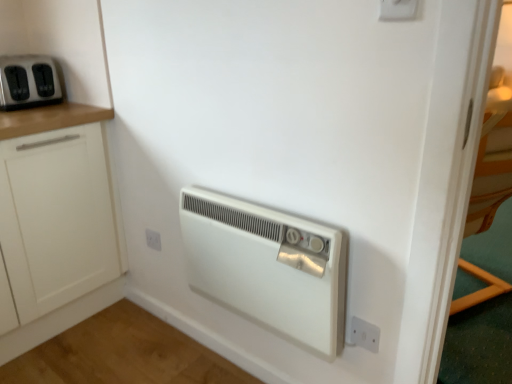
Question: Is white plastic heater at center, placed as the second home appliance when sorted from left to right, smaller than white matte cabinet at left?

Choices:
 (A) yes
 (B) no

Answer: (A)

Question: From a real-world perspective, is white plastic heater at center, which appears as the first home appliance when viewed from the front, under white matte cabinet at left?

Choices:
 (A) no
 (B) yes

Answer: (A)

Question: Is white matte cabinet at left located within white plastic heater at center, arranged as the 2th home appliance when viewed from the top?

Choices:
 (A) no
 (B) yes

Answer: (A)

Question: Considering the relative positions of white plastic heater at center, the 2th home appliance from the back, and white matte cabinet at left in the image provided, is white plastic heater at center, the 2th home appliance from the back, to the right of white matte cabinet at left from the viewer's perspective?

Choices:
 (A) yes
 (B) no

Answer: (A)

Question: Can we say white plastic heater at center, which appears as the first home appliance when viewed from the right, lies outside white matte cabinet at left?

Choices:
 (A) yes
 (B) no

Answer: (A)

Question: Is white plastic heater at center, the 1th home appliance in the bottom-to-top sequence, looking in the opposite direction of white matte cabinet at left?

Choices:
 (A) yes
 (B) no

Answer: (B)

Question: Is white plastic electric outlet at upper right, the 2th electric outlet when ordered from left to right, taller than white plastic electric outlet at lower right, which appears as the first electric outlet when viewed from the right?

Choices:
 (A) yes
 (B) no

Answer: (A)

Question: Is white plastic electric outlet at upper right, the third electric outlet positioned from the back, aimed at white plastic electric outlet at lower right, acting as the 2th electric outlet starting from the back?

Choices:
 (A) no
 (B) yes

Answer: (A)

Question: Can you confirm if white plastic electric outlet at upper right, the first electric outlet positioned from the front, is positioned to the right of white plastic electric outlet at lower right, which is the 1th electric outlet in bottom-to-top order?

Choices:
 (A) yes
 (B) no

Answer: (B)

Question: From the image's perspective, is white plastic electric outlet at upper right, the first electric outlet positioned from the front, located above white plastic electric outlet at lower right, placed as the third electric outlet when sorted from top to bottom?

Choices:
 (A) yes
 (B) no

Answer: (A)

Question: Is white plastic electric outlet at upper right, placed as the 3th electric outlet when sorted from bottom to top, positioned behind white plastic electric outlet at lower right, which appears as the first electric outlet when viewed from the right?

Choices:
 (A) yes
 (B) no

Answer: (B)

Question: Does white plastic electric outlet at upper right, the first electric outlet positioned from the front, have a smaller size compared to white plastic electric outlet at lower right, which appears as the first electric outlet when viewed from the right?

Choices:
 (A) yes
 (B) no

Answer: (B)

Question: Can you confirm if white plastic electric outlet at lower center, the 3th electric outlet in the front-to-back sequence, is smaller than matte black toaster at upper left, acting as the 1th home appliance starting from the left?

Choices:
 (A) no
 (B) yes

Answer: (B)